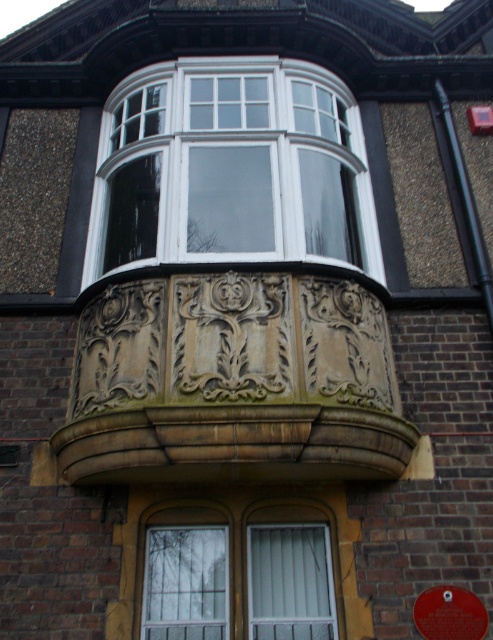
Is carved stone balcony at center further to the viewer compared to white glossy bay window at upper center?

No, it is in front of white glossy bay window at upper center.

Between carved stone balcony at center and white glossy bay window at upper center, which one has more height?

white glossy bay window at upper center is taller.

Who is more distant from viewer, (125, 308) or (247, 189)?

Positioned behind is point (247, 189).

At what (x,y) coordinates should I click in order to perform the action: click on carved stone balcony at center. Please return your answer as a coordinate pair (x, y). The height and width of the screenshot is (640, 493). Looking at the image, I should click on (234, 381).

Is white glossy bay window at upper center closer to the viewer compared to white textured glass at lower center?

No, it is not.

Which of these two, white glossy bay window at upper center or white textured glass at lower center, stands shorter?

With less height is white textured glass at lower center.

In order to click on white glossy bay window at upper center in this screenshot , I will do `click(231, 168)`.

What do you see at coordinates (234, 381) in the screenshot? I see `carved stone balcony at center` at bounding box center [234, 381].

The height and width of the screenshot is (640, 493). Find the location of `carved stone balcony at center`. carved stone balcony at center is located at coordinates (234, 381).